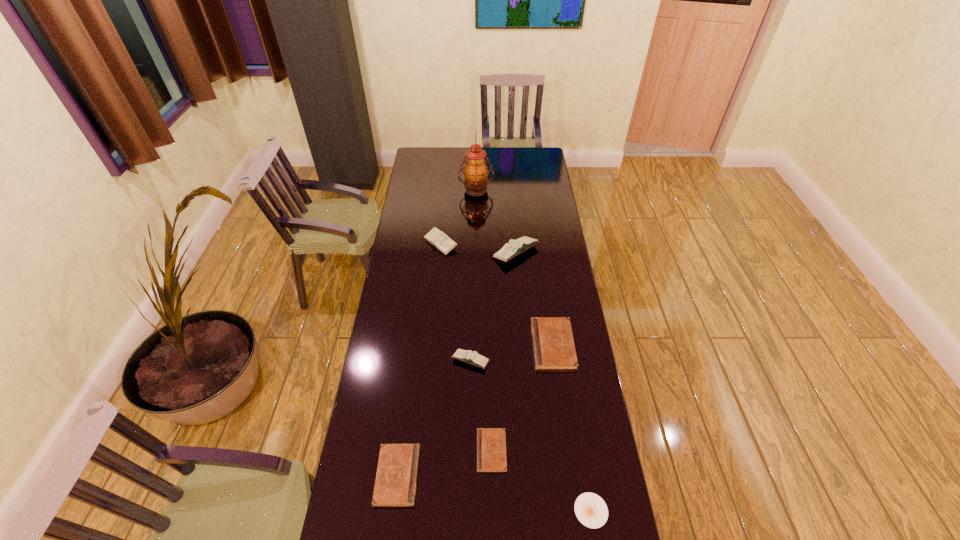
The height and width of the screenshot is (540, 960). I want to click on free space at the right edge of the desktop, so click(x=584, y=488).

The width and height of the screenshot is (960, 540). What are the coordinates of `empty space that is in between the second smallest brown diary and the fourth shortest object` in the screenshot? It's located at (475, 410).

Find the location of a particular element. Image resolution: width=960 pixels, height=540 pixels. vacant space that's between the seventh shortest object and the second smallest brown diary is located at coordinates (457, 364).

Locate an element on the screen. The width and height of the screenshot is (960, 540). empty space between the third shortest diary and the oil lamp is located at coordinates (515, 267).

Locate an element on the screen. The image size is (960, 540). free spot between the second biggest pink diary and the second smallest brown diary is located at coordinates (420, 359).

Where is `vacant space that is in between the leftmost brown diary and the fifth shortest object`? The height and width of the screenshot is (540, 960). vacant space that is in between the leftmost brown diary and the fifth shortest object is located at coordinates (434, 418).

The height and width of the screenshot is (540, 960). In order to click on free space between the fifth shortest diary and the tallest diary in this screenshot , I will do `click(478, 248)`.

Find the location of a particular element. The height and width of the screenshot is (540, 960). vacant space in between the smallest brown diary and the second biggest pink diary is located at coordinates 467,347.

This screenshot has width=960, height=540. In order to click on free space between the second tallest object and the fourth shortest object in this screenshot , I will do `click(535, 299)`.

The width and height of the screenshot is (960, 540). I want to click on vacant region between the egg yolk and the seventh tallest object, so click(541, 481).